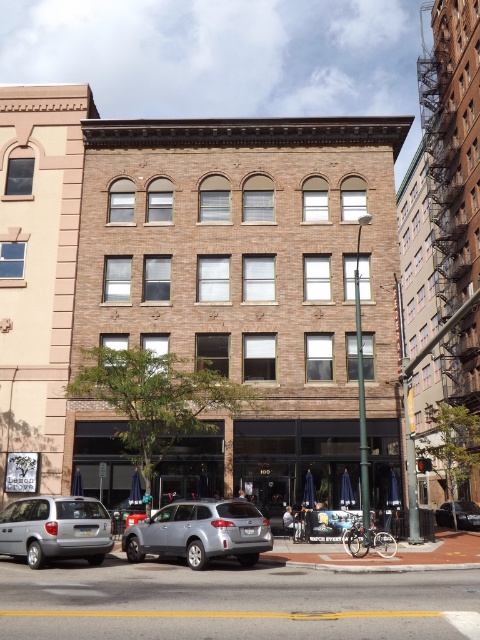
Who is shorter, satin silver suv at center or silver metallic minivan at lower left?

silver metallic minivan at lower left

Does satin silver suv at center appear over silver metallic minivan at lower left?

No, satin silver suv at center is not above silver metallic minivan at lower left.

Is point (214, 529) positioned before point (51, 557)?

Yes, point (214, 529) is closer to viewer.

You are a GUI agent. You are given a task and a screenshot of the screen. Output one action in this format:
    pyautogui.click(x=<x>, y=<y>)
    Task: Click on the satin silver suv at center
    The width and height of the screenshot is (480, 640).
    Given the screenshot: What is the action you would take?
    pyautogui.click(x=201, y=532)

Image resolution: width=480 pixels, height=640 pixels. Describe the element at coordinates (201, 532) in the screenshot. I see `satin silver suv at center` at that location.

Which is behind, point (159, 518) or point (468, 516)?

The point (468, 516) is behind.

The image size is (480, 640). What are the coordinates of `satin silver suv at center` in the screenshot? It's located at (201, 532).

Locate an element on the screen. The height and width of the screenshot is (640, 480). silver metallic minivan at lower left is located at coordinates (56, 529).

Can you confirm if silver metallic minivan at lower left is positioned to the right of silver metallic sedan at center?

Incorrect, silver metallic minivan at lower left is not on the right side of silver metallic sedan at center.

At what (x,y) coordinates should I click in order to perform the action: click on silver metallic minivan at lower left. Please return your answer as a coordinate pair (x, y). This screenshot has height=640, width=480. Looking at the image, I should click on (56, 529).